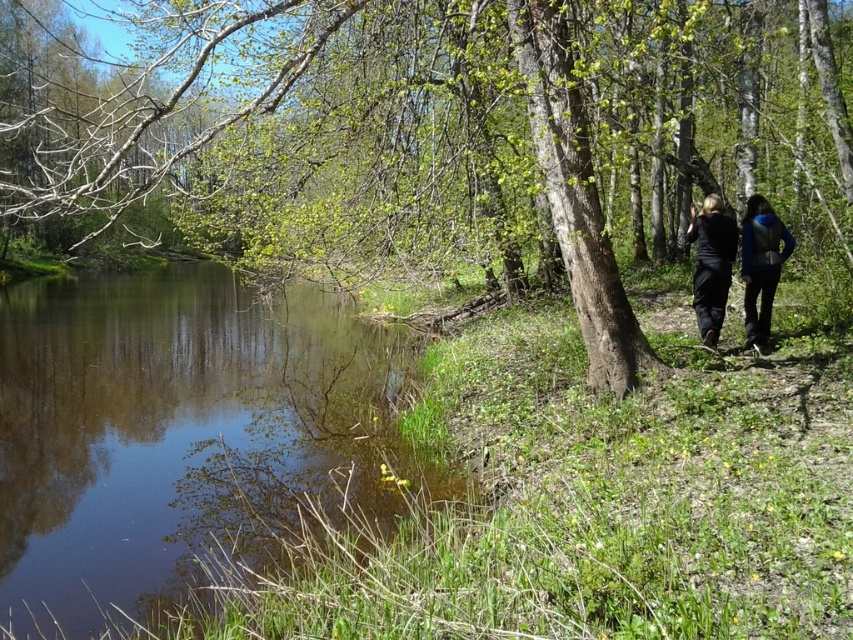
Can you confirm if greenish-brown water at center-left is taller than blue fabric jacket at right?

Yes.

From the picture: Who is more distant from viewer, (19, 605) or (753, 216)?

Point (753, 216)

Is point (370, 346) in front of point (779, 225)?

No, (370, 346) is further to viewer.

This screenshot has height=640, width=853. Find the location of `greenish-brown water at center-left`. greenish-brown water at center-left is located at coordinates (177, 429).

Does point (268, 204) come behind point (759, 276)?

Yes, point (268, 204) is behind point (759, 276).

Does green rough bark tree at right appear on the right side of blue fabric jacket at right?

Incorrect, green rough bark tree at right is not on the right side of blue fabric jacket at right.

Between point (622, 29) and point (772, 227), which one is positioned in front?

Point (622, 29)

Where is `green rough bark tree at right`? green rough bark tree at right is located at coordinates (425, 128).

Is blue fabric jacket at right to the right of black matte pants at lower right from the viewer's perspective?

Indeed, blue fabric jacket at right is positioned on the right side of black matte pants at lower right.

Between blue fabric jacket at right and black matte pants at lower right, which one appears on the right side from the viewer's perspective?

blue fabric jacket at right

Who is more distant from viewer, (749, 205) or (727, 243)?

Point (749, 205)

Locate an element on the screen. The width and height of the screenshot is (853, 640). blue fabric jacket at right is located at coordinates (761, 266).